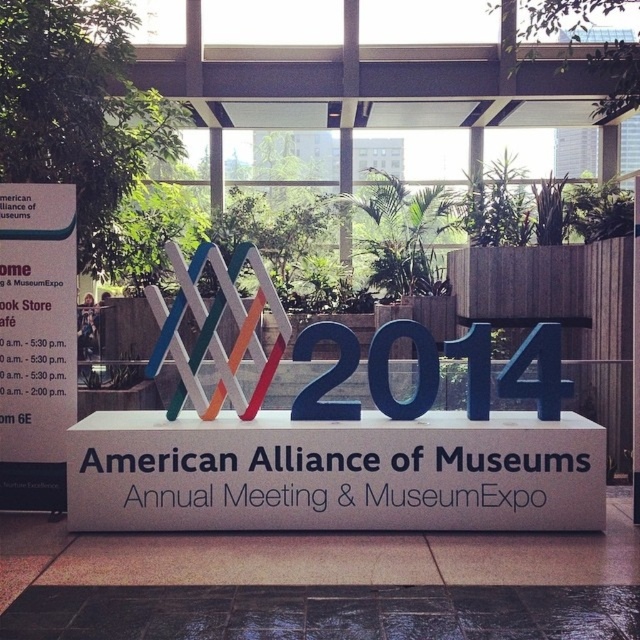
Question: From the image, what is the correct spatial relationship of white matte sign at center in relation to black tile floor at lower center?

Choices:
 (A) left
 (B) right

Answer: (B)

Question: Where is white matte sign at center located in relation to black tile floor at lower center in the image?

Choices:
 (A) below
 (B) above

Answer: (B)

Question: Which point appears farthest from the camera in this image?

Choices:
 (A) [381, 449]
 (B) [189, 612]

Answer: (A)

Question: Among these objects, which one is nearest to the camera?

Choices:
 (A) white matte sign at center
 (B) black tile floor at lower center

Answer: (B)

Question: Is white matte sign at center positioned before black tile floor at lower center?

Choices:
 (A) yes
 (B) no

Answer: (B)